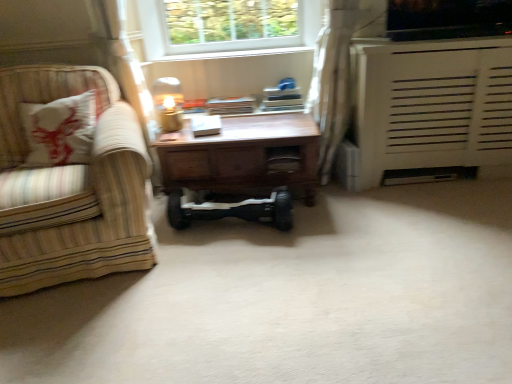
Locate an element on the screen. The height and width of the screenshot is (384, 512). free spot to the right of black rubber hoverboard at center is located at coordinates (327, 230).